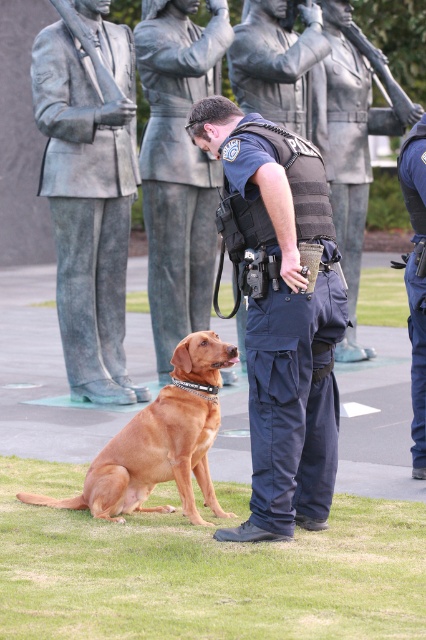
You are a photographer planning to take a portrait of the brushed metal statue at center and the golden brown fur at center. Since you want to highlight the size difference between them, which object should you position closer to the camera to emphasize their size contrast?

To emphasize the size contrast between the brushed metal statue at center and the golden brown fur at center, you should position the golden brown fur at center closer to the camera since it is smaller than the statue. This will make the smaller object appear larger in the frame relative to the statue, enhancing the visual contrast between their sizes.

You are a photographer trying to capture a clear photo of the brushed metal statue at center without the blue uniform pants at center blocking the view. Based on their positions, is this possible?

The brushed metal statue at center is located above the blue uniform pants at center, so it is possible to capture a clear photo of the brushed metal statue at center without the blue uniform pants at center blocking the view by angling the camera upwards.

Looking at this image, you are a photographer setting up for a group photo. You need to position the brushed metal statue at center and the golden brown fur at center so that they are aligned properly. According to the scene, which object should be placed to the left to maintain the original arrangement?

The brushed metal statue at center should be placed to the left of the golden brown fur at center because it is positioned on the left side of it in the original scene.